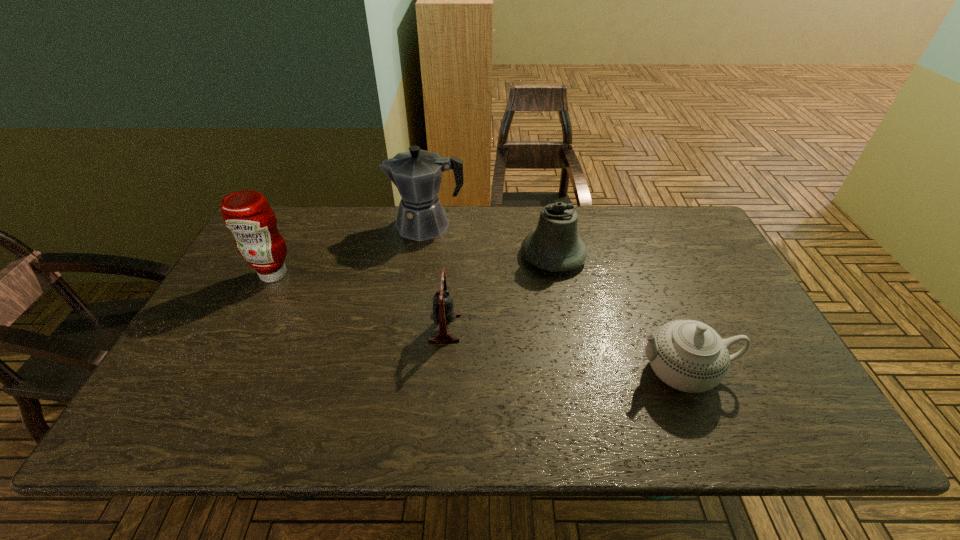
You are a GUI agent. You are given a task and a screenshot of the screen. Output one action in this format:
    pyautogui.click(x=<x>, y=<y>)
    Task: Click on the free space between the right bell and the rightmost object
    Image resolution: width=960 pixels, height=540 pixels.
    Given the screenshot: What is the action you would take?
    pyautogui.click(x=618, y=314)

Locate an element on the screen. vacant space that is in between the rightmost object and the nearer bell is located at coordinates (564, 350).

Find the location of a particular element. The image size is (960, 540). free space that is in between the coffeepot and the nearer bell is located at coordinates (436, 276).

At what (x,y) coordinates should I click in order to perform the action: click on vacant point located between the leftmost object and the farther bell. Please return your answer as a coordinate pair (x, y). Looking at the image, I should click on (414, 265).

You are a GUI agent. You are given a task and a screenshot of the screen. Output one action in this format:
    pyautogui.click(x=<x>, y=<y>)
    Task: Click on the vacant area that lies between the chinaware and the condiment
    
    Given the screenshot: What is the action you would take?
    pyautogui.click(x=478, y=323)

Locate an element on the screen. The image size is (960, 540). free area in between the condiment and the farther bell is located at coordinates (414, 265).

The image size is (960, 540). Find the location of `object that is the nearest to the second object from right to left`. object that is the nearest to the second object from right to left is located at coordinates (417, 174).

This screenshot has height=540, width=960. I want to click on object that stands as the fourth closest to the left bell, so click(246, 213).

This screenshot has height=540, width=960. Identify the location of blank space that satisfies the following two spatial constraints: 1. at the spout of the second object from right to left; 2. on the right side of the coffeepot. (422, 255).

What are the coordinates of `free space that satisfies the following two spatial constraints: 1. at the spout of the nearer bell; 2. on the left side of the coffeepot` in the screenshot? It's located at (x=412, y=328).